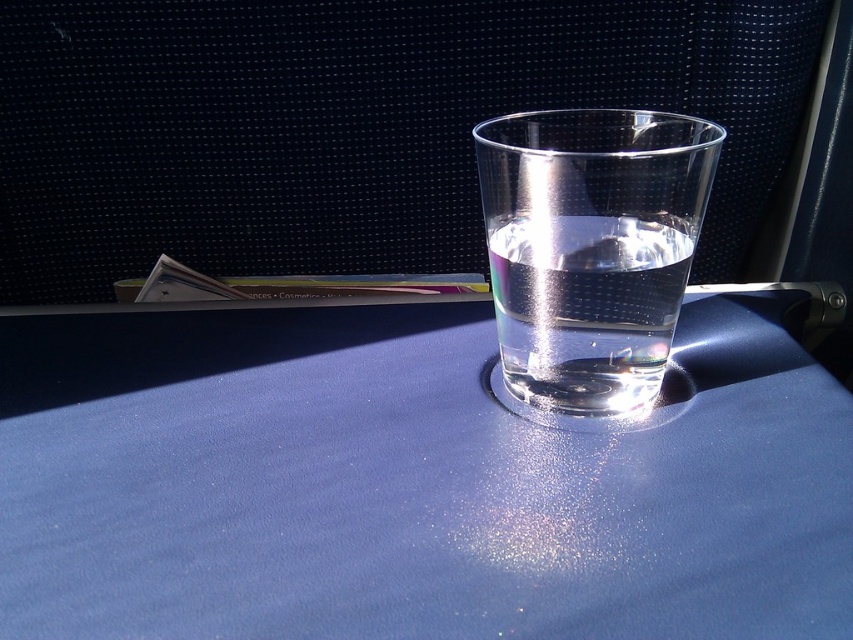
Question: Which point is farther to the camera?

Choices:
 (A) (581, 170)
 (B) (285, 349)

Answer: (B)

Question: Does blue matte table at center have a greater width compared to transparent glass at center?

Choices:
 (A) no
 (B) yes

Answer: (B)

Question: Does blue matte table at center have a larger size compared to transparent glass at center?

Choices:
 (A) yes
 (B) no

Answer: (A)

Question: Does blue matte table at center appear under transparent glass at center?

Choices:
 (A) no
 (B) yes

Answer: (B)

Question: Which point is closer to the camera?

Choices:
 (A) transparent glass at center
 (B) blue matte table at center

Answer: (B)